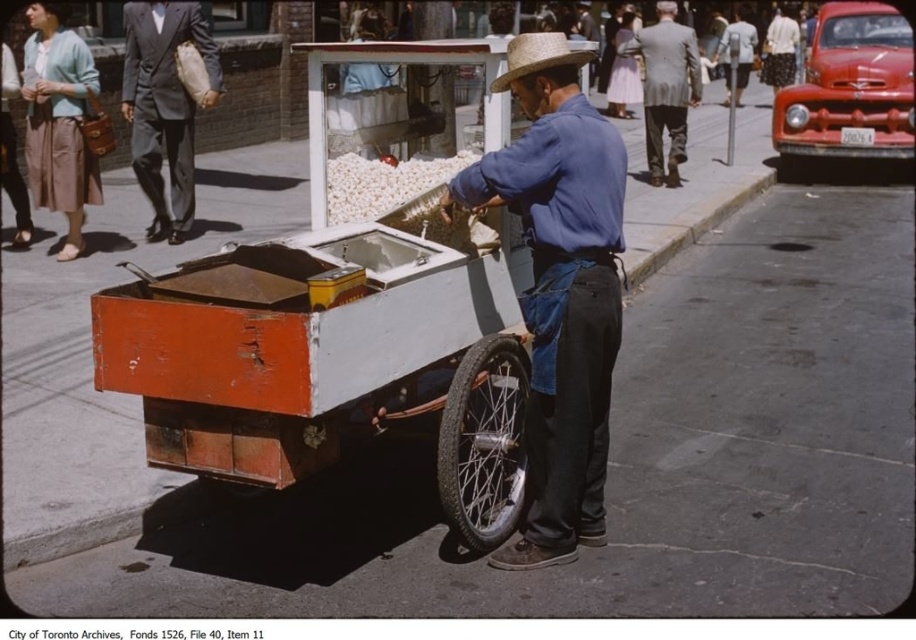
Question: Which point appears closest to the camera in this image?

Choices:
 (A) (747, 72)
 (B) (464, 508)
 (C) (533, 65)
 (D) (180, 108)

Answer: (C)

Question: Does rusty metal cart at center appear over dark gray suit at upper left?

Choices:
 (A) yes
 (B) no

Answer: (B)

Question: Which point appears farthest from the camera in this image?

Choices:
 (A) (527, 61)
 (B) (473, 416)
 (C) (326, 205)

Answer: (C)

Question: Is blue denim shirt at center wider than matte blue shirt at center?

Choices:
 (A) no
 (B) yes

Answer: (A)

Question: Does dark gray suit at upper left have a greater width compared to gray wool suit at upper center?

Choices:
 (A) no
 (B) yes

Answer: (B)

Question: Which of the following is the farthest from the observer?

Choices:
 (A) gray wool suit at upper center
 (B) straw hat at center
 (C) dark gray suit at upper left
 (D) blue denim shirt at center

Answer: (A)